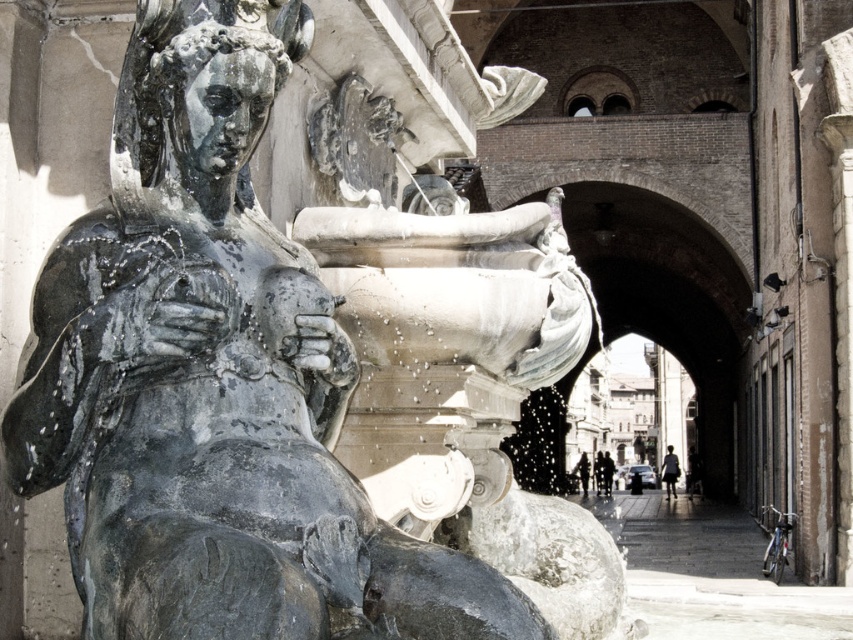
Question: Which object is the closest to the bronze statue at left?

Choices:
 (A) silhouette fabric person at center
 (B) dark gray fabric person at center

Answer: (B)

Question: Among these points, which one is farthest from the camera?

Choices:
 (A) (672, 484)
 (B) (276, 632)
 (C) (607, 467)
 (D) (585, 486)

Answer: (C)

Question: Does bronze statue at left have a greater width compared to silhouette fabric person at center?

Choices:
 (A) yes
 (B) no

Answer: (B)

Question: Does silhouette fabric person at center appear on the right side of dark gray fabric person at center?

Choices:
 (A) no
 (B) yes

Answer: (B)

Question: Which point is closer to the camera?

Choices:
 (A) bronze statue at left
 (B) dark gray fabric person at center
 (C) silhouette fabric person at center
 (D) dark fabric coat at center

Answer: (A)

Question: Can you confirm if bronze statue at left is wider than dark fabric coat at center?

Choices:
 (A) yes
 (B) no

Answer: (A)